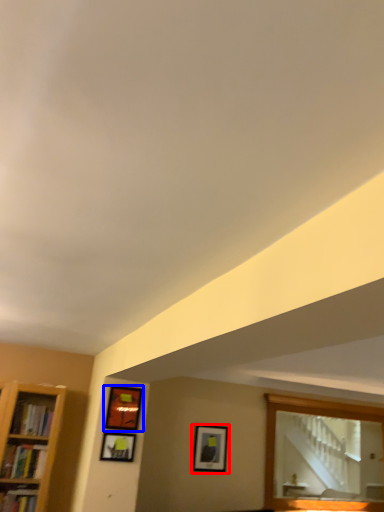
Question: Which of the following is the farthest to the observer, picture frame (highlighted by a red box) or picture frame (highlighted by a blue box)?

Choices:
 (A) picture frame
 (B) picture frame

Answer: (A)